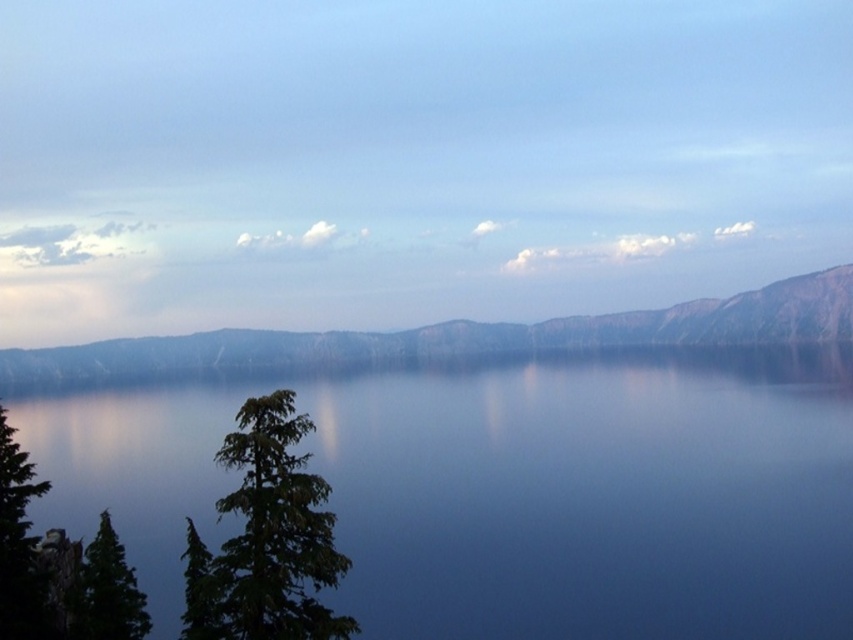
Between point (408, 337) and point (223, 451), which one is positioned in front?

Point (223, 451)

Who is higher up, rugged stone mountain at upper center or green textured tree at left?

rugged stone mountain at upper center is above.

Where is `rugged stone mountain at upper center`? This screenshot has width=853, height=640. rugged stone mountain at upper center is located at coordinates (463, 336).

Where is `rugged stone mountain at upper center`? rugged stone mountain at upper center is located at coordinates pyautogui.click(x=463, y=336).

Can you confirm if blue reflective water at center is positioned to the right of green textured tree at left?

In fact, blue reflective water at center is to the left of green textured tree at left.

Is point (641, 588) closer to camera compared to point (277, 413)?

No, (641, 588) is behind (277, 413).

Where is `blue reflective water at center`? Image resolution: width=853 pixels, height=640 pixels. blue reflective water at center is located at coordinates (503, 486).

Which of these two, rugged stone mountain at upper center or green matte tree at lower left, stands taller?

Standing taller between the two is rugged stone mountain at upper center.

Can you confirm if rugged stone mountain at upper center is positioned below green matte tree at lower left?

No.

The height and width of the screenshot is (640, 853). Identify the location of rugged stone mountain at upper center. (463, 336).